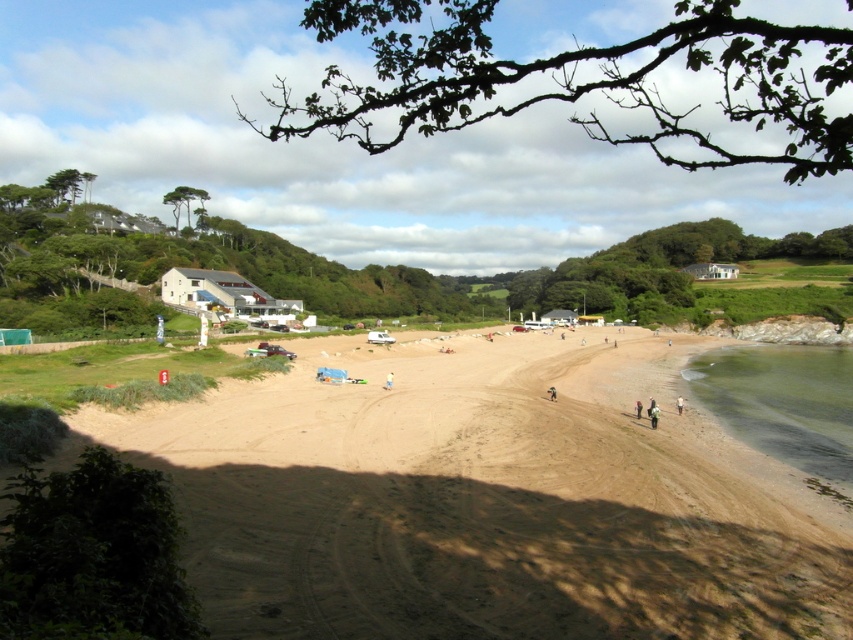
You are standing on the beach and see the light brown sand at lower right and the dark brown leather jacket at center. Which object is located to the right of the other?

The light brown sand at lower right is located to the right of the dark brown leather jacket at center.

You are standing on the beach and see both the clear water at lower right and the green fabric jacket at lower right. Which object is closer to the right edge of the beach?

The clear water at lower right is to the right of the green fabric jacket at lower right, so it is closer to the right edge of the beach.